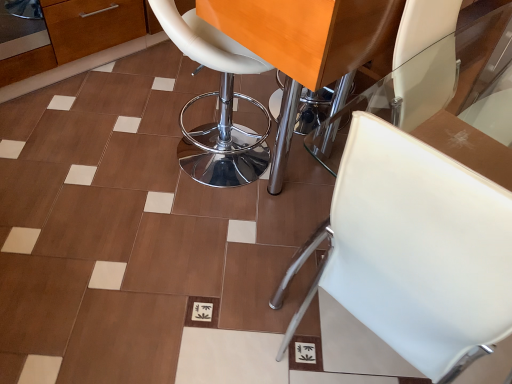
You are a GUI agent. You are given a task and a screenshot of the screen. Output one action in this format:
    pyautogui.click(x=<x>, y=<y>)
    Task: Click on the free spot in front of white leather stool at center, the 1th chair positioned from the left
    This screenshot has width=512, height=384.
    Given the screenshot: What is the action you would take?
    pyautogui.click(x=175, y=240)